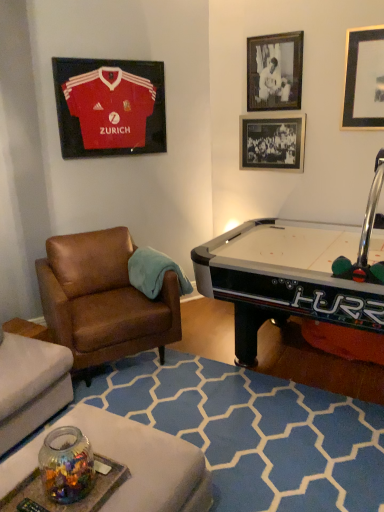
Measure the distance between brown leather chair at left and camera.

brown leather chair at left and camera are 8.45 feet apart.

What do you see at coordinates (103, 298) in the screenshot? I see `brown leather chair at left` at bounding box center [103, 298].

Locate an element on the screen. The width and height of the screenshot is (384, 512). matte jersey at upper left, arranged as the fourth picture frame when viewed from the right is located at coordinates (109, 106).

Which of these two, brown leather chair at left or black matte picture frame at upper right, arranged as the 3th picture frame when viewed from the right, stands taller?

brown leather chair at left is taller.

From a real-world perspective, does brown leather chair at left stand above black matte picture frame at upper right, the 2th picture frame viewed from the left?

No.

Which is behind, brown leather chair at left or black matte picture frame at upper right, the 2th picture frame viewed from the left?

black matte picture frame at upper right, the 2th picture frame viewed from the left, is further away from the camera.

Considering the sizes of objects brown leather chair at left and black matte picture frame at upper right, the 2th picture frame viewed from the left, in the image provided, who is bigger, brown leather chair at left or black matte picture frame at upper right, the 2th picture frame viewed from the left,?

Bigger between the two is brown leather chair at left.

The width and height of the screenshot is (384, 512). I want to click on chair below the matte jersey at upper left, positioned as the 1th picture frame in left-to-right order (from a real-world perspective), so click(103, 298).

From a real-world perspective, between brown leather chair at left and matte jersey at upper left, arranged as the fourth picture frame when viewed from the right, who is vertically lower?

From a 3D spatial view, brown leather chair at left is below.

Considering their positions, is brown leather chair at left located in front of or behind matte jersey at upper left, positioned as the 1th picture frame in left-to-right order?

Clearly, brown leather chair at left is in front of matte jersey at upper left, positioned as the 1th picture frame in left-to-right order.

Which point is more forward, (159, 318) or (93, 65)?

Positioned in front is point (159, 318).

Does point (346, 98) come closer to viewer compared to point (254, 39)?

That is True.

From the image's perspective, which object appears higher, black matte picture frame at upper right, which appears as the first picture frame when viewed from the right, or black matte picture frame at upper right, arranged as the 3th picture frame when viewed from the right?

black matte picture frame at upper right, arranged as the 3th picture frame when viewed from the right, from the image's perspective.

Is black matte picture frame at upper right, which appears as the first picture frame when viewed from the right, looking in the opposite direction of black matte picture frame at upper right, the 2th picture frame viewed from the left?

No, black matte picture frame at upper right, which appears as the first picture frame when viewed from the right,'s orientation is not away from black matte picture frame at upper right, the 2th picture frame viewed from the left.

From the image's perspective, which object appears higher, black matte picture frame at upper right, which appears as the first picture frame when viewed from the right, or black glass picture frame at upper right, the 2th picture frame from the right?

black matte picture frame at upper right, which appears as the first picture frame when viewed from the right, appears higher in the image.

Could you measure the distance between black matte picture frame at upper right, marked as the 4th picture frame in a left-to-right arrangement, and black glass picture frame at upper right, placed as the 3th picture frame when sorted from left to right?

black matte picture frame at upper right, marked as the 4th picture frame in a left-to-right arrangement, is 20.87 inches from black glass picture frame at upper right, placed as the 3th picture frame when sorted from left to right.

Would you say black matte picture frame at upper right, marked as the 4th picture frame in a left-to-right arrangement, is inside or outside black glass picture frame at upper right, placed as the 3th picture frame when sorted from left to right?

black matte picture frame at upper right, marked as the 4th picture frame in a left-to-right arrangement, lies outside black glass picture frame at upper right, placed as the 3th picture frame when sorted from left to right.

Is point (301, 49) in front of point (82, 91)?

No, (301, 49) is behind (82, 91).

Is matte jersey at upper left, arranged as the fourth picture frame when viewed from the right, surrounded by black matte picture frame at upper right, arranged as the 3th picture frame when viewed from the right?

No.

What's the angular difference between black glass picture frame at upper right, placed as the 3th picture frame when sorted from left to right, and brown leather chair at left's facing directions?

The facing directions of black glass picture frame at upper right, placed as the 3th picture frame when sorted from left to right, and brown leather chair at left are 57.7 degrees apart.

Is black glass picture frame at upper right, the 2th picture frame from the right, aimed at brown leather chair at left?

No, black glass picture frame at upper right, the 2th picture frame from the right, does not turn towards brown leather chair at left.

From a real-world perspective, is black glass picture frame at upper right, the 2th picture frame from the right, positioned over brown leather chair at left based on gravity?

Yes.

From the image's perspective, which picture frame is the 1st one above the brown leather chair at left? Please provide its 2D coordinates.

[(272, 142)]

This screenshot has width=384, height=512. I want to click on chair that is below the black matte picture frame at upper right, marked as the 4th picture frame in a left-to-right arrangement (from the image's perspective), so click(x=103, y=298).

Is the position of brown leather chair at left more distant than that of black matte picture frame at upper right, marked as the 4th picture frame in a left-to-right arrangement?

No, it is not.

From a real-world perspective, which is physically below, brown leather chair at left or black matte picture frame at upper right, which appears as the first picture frame when viewed from the right?

brown leather chair at left.

How distant is brown leather chair at left from black matte picture frame at upper right, marked as the 4th picture frame in a left-to-right arrangement?

brown leather chair at left is 2.04 meters from black matte picture frame at upper right, marked as the 4th picture frame in a left-to-right arrangement.

The height and width of the screenshot is (512, 384). In order to click on chair lying in front of the black matte picture frame at upper right, arranged as the 3th picture frame when viewed from the right in this screenshot , I will do `click(103, 298)`.

The image size is (384, 512). In order to click on chair below the matte jersey at upper left, positioned as the 1th picture frame in left-to-right order (from a real-world perspective) in this screenshot , I will do `click(103, 298)`.

Consider the image. From the image, which object appears to be nearer to matte jersey at upper left, positioned as the 1th picture frame in left-to-right order, black matte picture frame at upper right, marked as the 4th picture frame in a left-to-right arrangement, or brown leather chair at left?

brown leather chair at left.

From the picture: Considering their positions, is black glass picture frame at upper right, the 2th picture frame from the right, positioned closer to matte jersey at upper left, arranged as the fourth picture frame when viewed from the right, than black matte picture frame at upper right, arranged as the 3th picture frame when viewed from the right?

black matte picture frame at upper right, arranged as the 3th picture frame when viewed from the right.

Based on their spatial positions, is black matte picture frame at upper right, which appears as the first picture frame when viewed from the right, or matte jersey at upper left, arranged as the fourth picture frame when viewed from the right, closer to black matte picture frame at upper right, arranged as the 3th picture frame when viewed from the right?

Based on the image, black matte picture frame at upper right, which appears as the first picture frame when viewed from the right, appears to be nearer to black matte picture frame at upper right, arranged as the 3th picture frame when viewed from the right.

Estimate the real-world distances between objects in this image. Which object is closer to black matte picture frame at upper right, arranged as the 3th picture frame when viewed from the right, matte jersey at upper left, arranged as the fourth picture frame when viewed from the right, or black matte picture frame at upper right, which appears as the first picture frame when viewed from the right?

black matte picture frame at upper right, which appears as the first picture frame when viewed from the right.

Based on their spatial positions, is black matte picture frame at upper right, the 2th picture frame viewed from the left, or brown leather chair at left further from matte jersey at upper left, arranged as the fourth picture frame when viewed from the right?

brown leather chair at left is further to matte jersey at upper left, arranged as the fourth picture frame when viewed from the right.

Considering their positions, is black glass picture frame at upper right, placed as the 3th picture frame when sorted from left to right, positioned closer to matte jersey at upper left, positioned as the 1th picture frame in left-to-right order, than black matte picture frame at upper right, marked as the 4th picture frame in a left-to-right arrangement?

Among the two, black glass picture frame at upper right, placed as the 3th picture frame when sorted from left to right, is located nearer to matte jersey at upper left, positioned as the 1th picture frame in left-to-right order.

Based on their spatial positions, is black matte picture frame at upper right, marked as the 4th picture frame in a left-to-right arrangement, or black matte picture frame at upper right, the 2th picture frame viewed from the left, further from black glass picture frame at upper right, placed as the 3th picture frame when sorted from left to right?

black matte picture frame at upper right, marked as the 4th picture frame in a left-to-right arrangement.

Consider the image. Considering their positions, is black matte picture frame at upper right, the 2th picture frame viewed from the left, positioned closer to black matte picture frame at upper right, which appears as the first picture frame when viewed from the right, than matte jersey at upper left, positioned as the 1th picture frame in left-to-right order?

black matte picture frame at upper right, the 2th picture frame viewed from the left, is positioned closer to the anchor black matte picture frame at upper right, which appears as the first picture frame when viewed from the right.

Locate an element on the screen. picture frame between black matte picture frame at upper right, arranged as the 3th picture frame when viewed from the right, and black matte picture frame at upper right, marked as the 4th picture frame in a left-to-right arrangement is located at coordinates (272, 142).

At what (x,y) coordinates should I click in order to perform the action: click on picture frame situated between matte jersey at upper left, arranged as the fourth picture frame when viewed from the right, and black glass picture frame at upper right, the 2th picture frame from the right, from left to right. Please return your answer as a coordinate pair (x, y). The height and width of the screenshot is (512, 384). Looking at the image, I should click on (274, 72).

This screenshot has width=384, height=512. In order to click on picture frame that lies between matte jersey at upper left, positioned as the 1th picture frame in left-to-right order, and brown leather chair at left from top to bottom in this screenshot , I will do `click(272, 142)`.